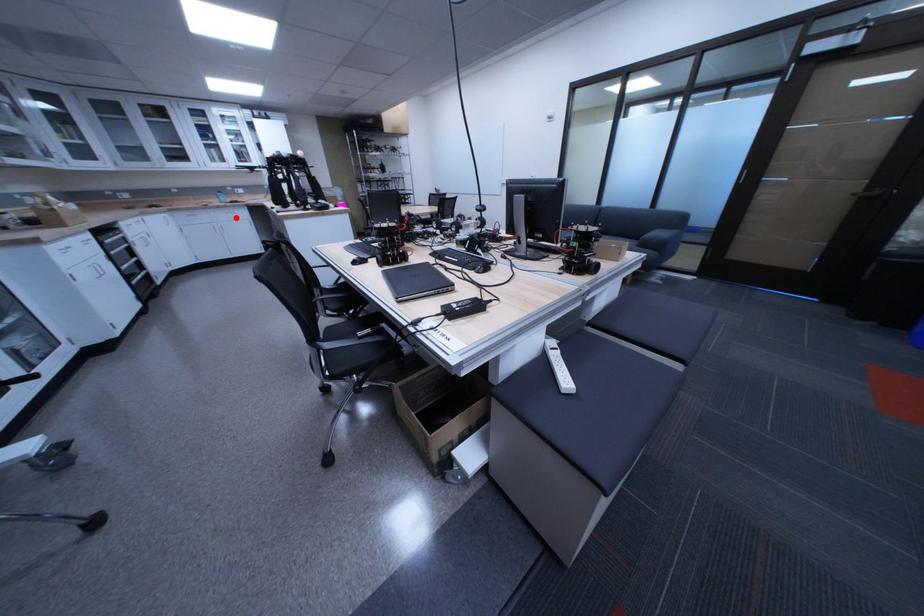
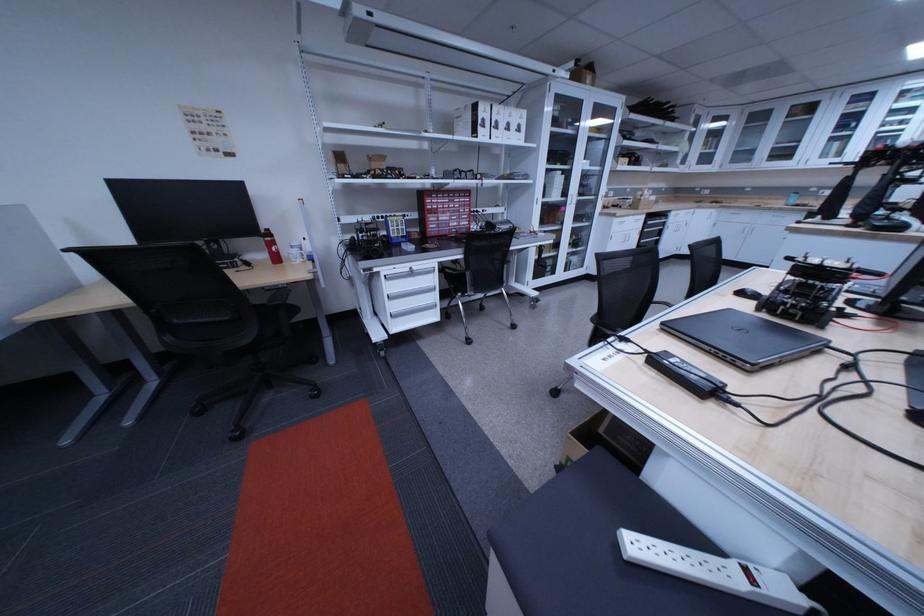
Question: A red point is marked in image1. In image2, is the corresponding 3D point closer to the camera or farther? Reply with the corresponding letter.

Choices:
 (A) The corresponding 3D point is closer.
 (B) The corresponding 3D point is farther.

Answer: (B)